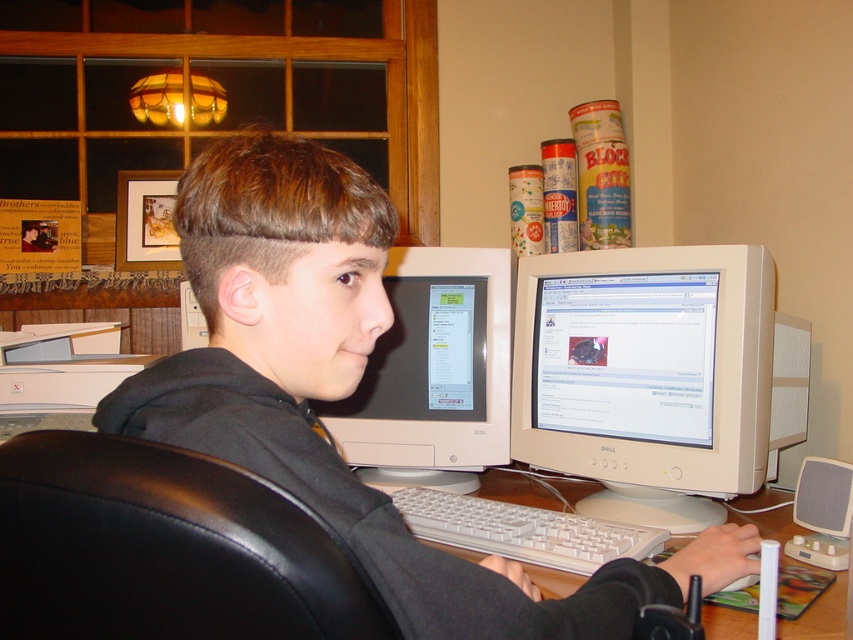
Question: Which object is closer to the camera taking this photo?

Choices:
 (A) wooden desk at center
 (B) white glossy monitor at center
 (C) white plastic monitor at center
 (D) white plastic keyboard at center

Answer: (A)

Question: Can you confirm if white plastic keyboard at center is bigger than wooden desk at center?

Choices:
 (A) yes
 (B) no

Answer: (B)

Question: Can you confirm if white plastic keyboard at center is bigger than wooden desk at center?

Choices:
 (A) yes
 (B) no

Answer: (B)

Question: Which object appears farthest from the camera in this image?

Choices:
 (A) wooden desk at center
 (B) white plastic keyboard at center

Answer: (B)

Question: Which object is positioned farthest from the white plastic keyboard at center?

Choices:
 (A) white glossy monitor at center
 (B) white plastic monitor at center
 (C) wooden desk at center

Answer: (A)

Question: Can you confirm if white glossy monitor at center is positioned to the left of white plastic keyboard at center?

Choices:
 (A) no
 (B) yes

Answer: (B)